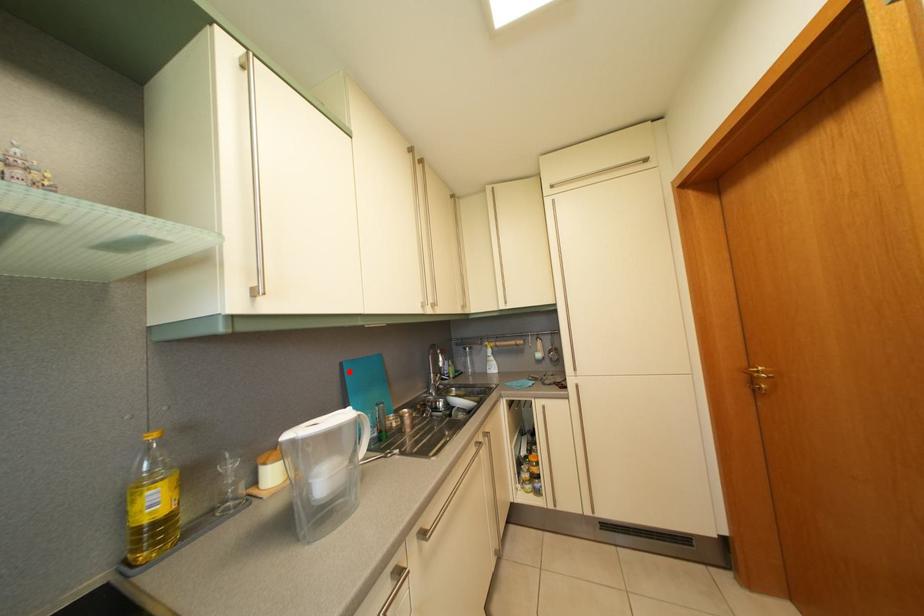
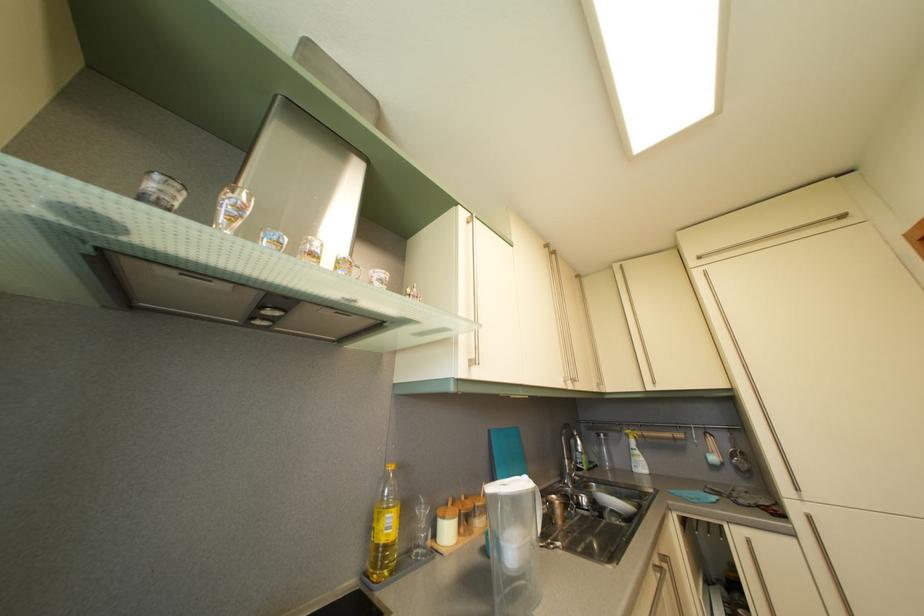
Where in the second image is the point corresponding to the highlighted location from the first image?

(497, 439)